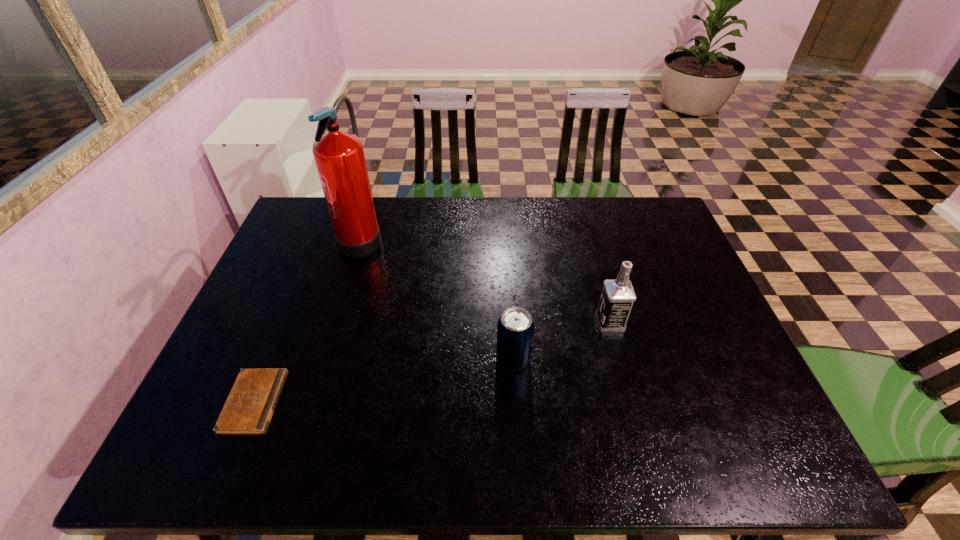
In the image, there is a desktop. At what (x,y) coordinates should I click in order to perform the action: click on free region at the left edge. Please return your answer as a coordinate pair (x, y). Image resolution: width=960 pixels, height=540 pixels. Looking at the image, I should click on (246, 347).

Locate an element on the screen. The height and width of the screenshot is (540, 960). free space at the right edge of the desktop is located at coordinates (732, 360).

At what (x,y) coordinates should I click in order to perform the action: click on vacant point located between the vodka and the tallest object. Please return your answer as a coordinate pair (x, y). The image size is (960, 540). Looking at the image, I should click on (486, 279).

You are a GUI agent. You are given a task and a screenshot of the screen. Output one action in this format:
    pyautogui.click(x=<x>, y=<y>)
    Task: Click on the vacant region between the leftmost object and the second shortest object
    This screenshot has width=960, height=540.
    Given the screenshot: What is the action you would take?
    pyautogui.click(x=384, y=381)

You are a GUI agent. You are given a task and a screenshot of the screen. Output one action in this format:
    pyautogui.click(x=<x>, y=<y>)
    Task: Click on the free spot between the shortest object and the second object from right to left
    The width and height of the screenshot is (960, 540).
    Given the screenshot: What is the action you would take?
    pyautogui.click(x=384, y=381)

Locate an element on the screen. The width and height of the screenshot is (960, 540). free point between the third object from right to left and the second shortest object is located at coordinates click(x=438, y=297).

Locate an element on the screen. The height and width of the screenshot is (540, 960). vacant space that is in between the shortest object and the second object from left to right is located at coordinates (308, 319).

The height and width of the screenshot is (540, 960). In order to click on free space between the second object from right to left and the farthest object in this screenshot , I will do `click(438, 297)`.

In order to click on free space between the second shortest object and the shortest object in this screenshot , I will do `click(384, 381)`.

The height and width of the screenshot is (540, 960). In order to click on free area in between the tallest object and the leftmost object in this screenshot , I will do `click(308, 319)`.